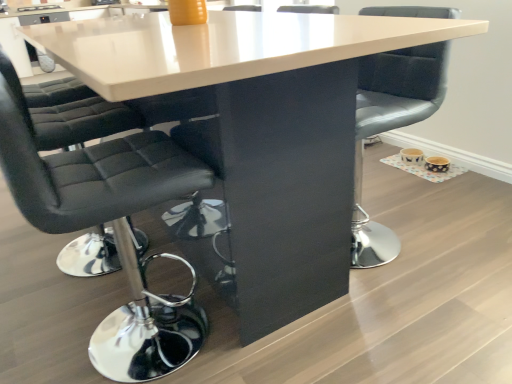
This screenshot has height=384, width=512. In order to click on free space in front of matte gray cushioned chair at center, which appears as the 1th chair when viewed from the right in this screenshot , I will do [409, 295].